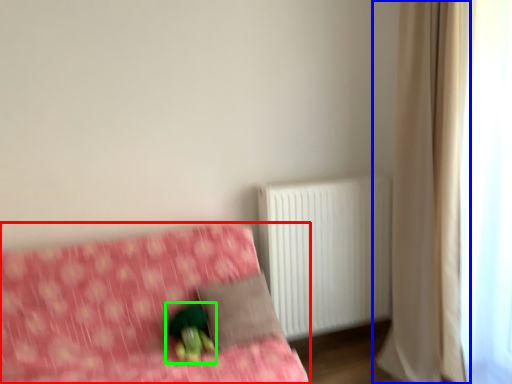
Question: Which object is positioned farthest from furniture (highlighted by a red box)? Select from curtain (highlighted by a blue box) and figurine (highlighted by a green box).

Choices:
 (A) curtain
 (B) figurine

Answer: (A)